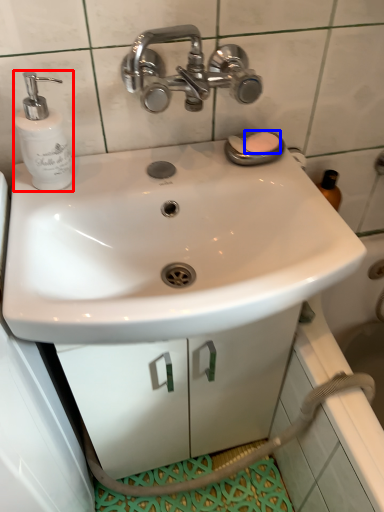
Question: Which point is further to the camera, soap dispenser (highlighted by a red box) or soap (highlighted by a blue box)?

Choices:
 (A) soap dispenser
 (B) soap

Answer: (B)